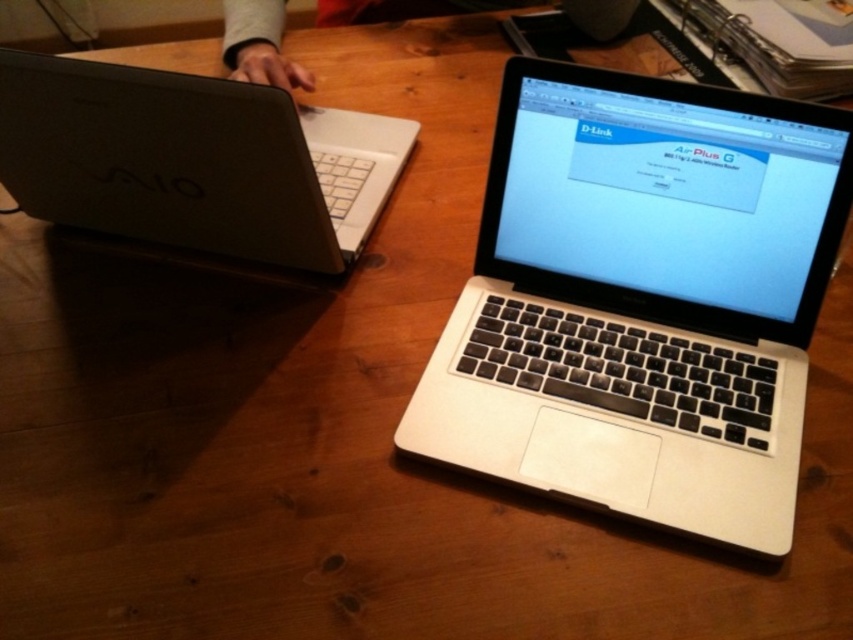
From the picture: Is silver/black keyboard at center to the left of matte black laptop at left from the viewer's perspective?

Incorrect, silver/black keyboard at center is not on the left side of matte black laptop at left.

Does point (570, 324) come farther from viewer compared to point (372, 170)?

No, (570, 324) is closer to viewer.

Identify the location of silver/black keyboard at center. (642, 300).

Is point (573, 177) positioned after point (357, 8)?

No, it is not.

Find the location of a particular element. silver/black keyboard at center is located at coordinates (642, 300).

Which is in front, point (277, 157) or point (498, 3)?

Positioned in front is point (277, 157).

Consider the image. Can you confirm if matte black laptop at left is positioned below skinny jeans at upper center?

Yes.

Between point (4, 188) and point (321, 22), which one is positioned behind?

Point (321, 22)

You are a GUI agent. You are given a task and a screenshot of the screen. Output one action in this format:
    pyautogui.click(x=<x>, y=<y>)
    Task: Click on the matte black laptop at left
    This screenshot has width=853, height=640.
    Given the screenshot: What is the action you would take?
    pyautogui.click(x=193, y=161)